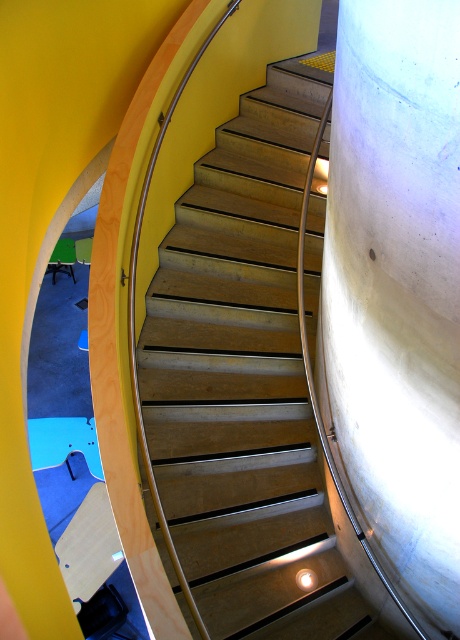
Is wooden stairs at center behind white concrete pillar at right?

Yes, it is.

Between wooden stairs at center and white concrete pillar at right, which one appears on the left side from the viewer's perspective?

From the viewer's perspective, wooden stairs at center appears more on the left side.

Measure the distance between point (237, 634) and camera.

Point (237, 634) and camera are 3.18 meters apart from each other.

The height and width of the screenshot is (640, 460). Find the location of `wooden stairs at center`. wooden stairs at center is located at coordinates (245, 384).